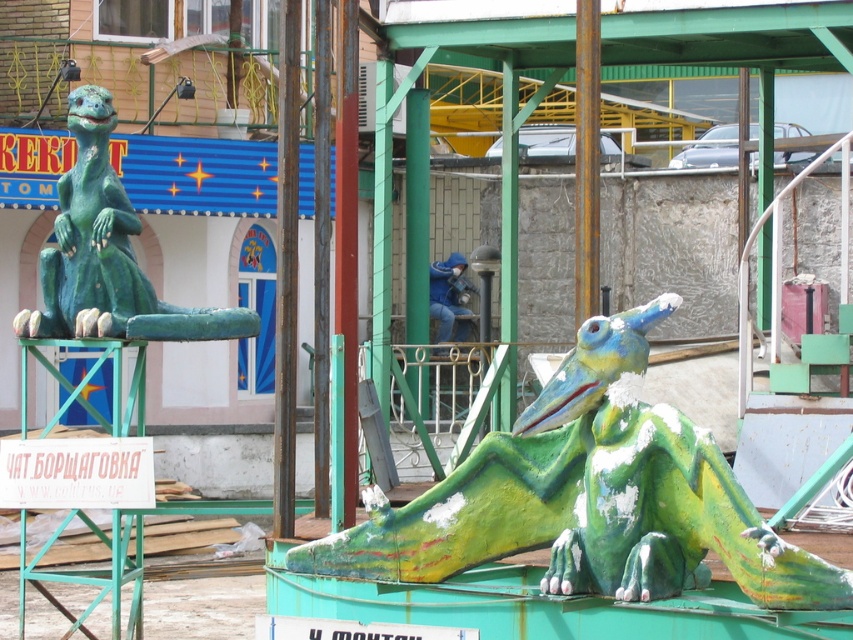
What is the position of the metallic pole at center relative to the rusty metal pole at center in the image?

The metallic pole at center is positioned to the left of the rusty metal pole at center.